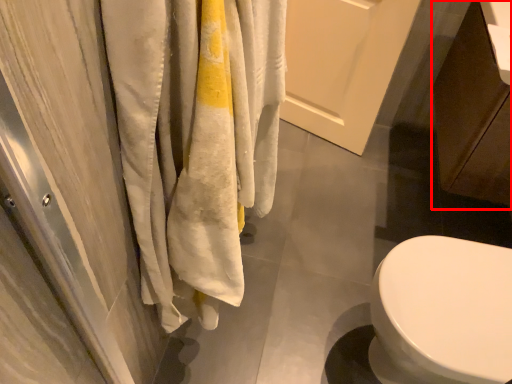
Question: From the image's perspective, where is cabinetry (annotated by the red box) located relative to screen door?

Choices:
 (A) below
 (B) above

Answer: (A)